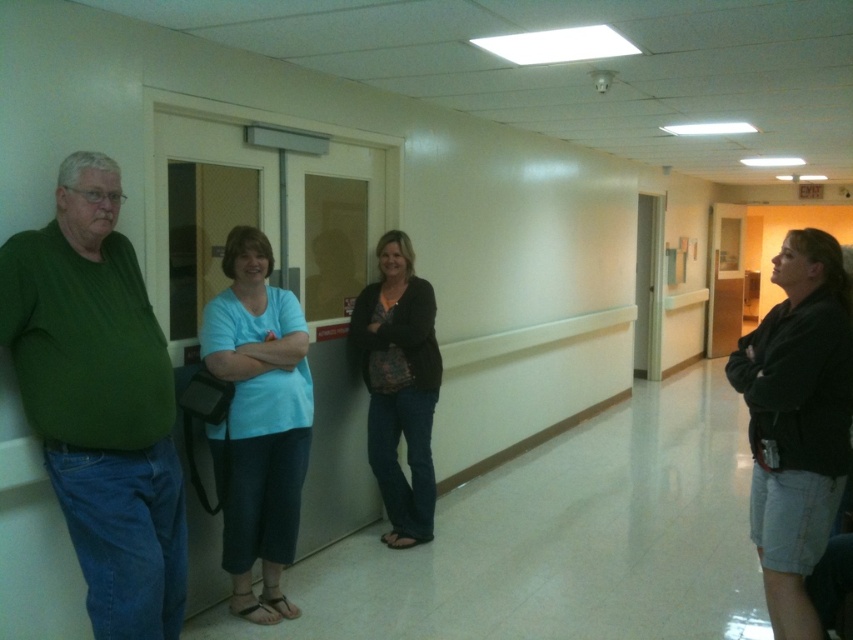
You are a security guard in the hallway and need to check the items on the green matte sweater at left and the black denim shorts at lower right. Which item is higher up in the scene?

The green matte sweater at left is above the black denim shorts at lower right, so the green matte sweater at left is higher up in the scene.